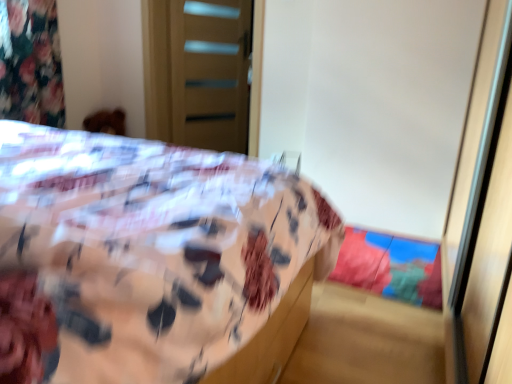
Find the location of a particular element. Image resolution: width=512 pixels, height=384 pixels. vacant region to the left of transparent plastic screen door at right, the 1th screen door viewed from the front is located at coordinates (394, 263).